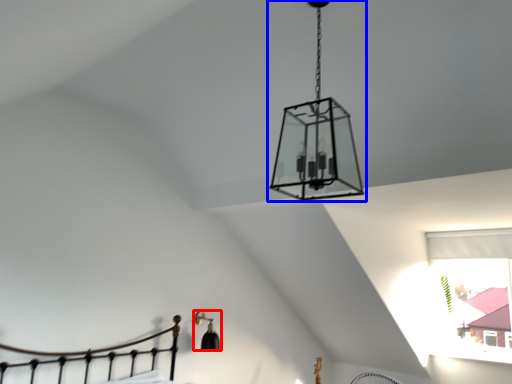
Question: Which of the following is the closest to the observer, lamp (highlighted by a red box) or lamp (highlighted by a blue box)?

Choices:
 (A) lamp
 (B) lamp

Answer: (B)